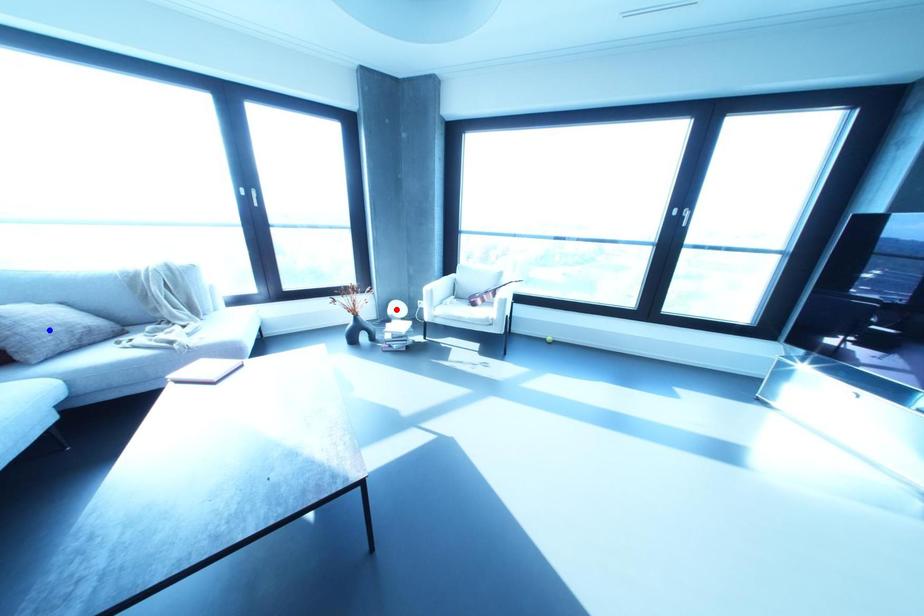
Question: Which of the two points in the image is closer to the camera?

Choices:
 (A) Blue point is closer.
 (B) Red point is closer.

Answer: (A)